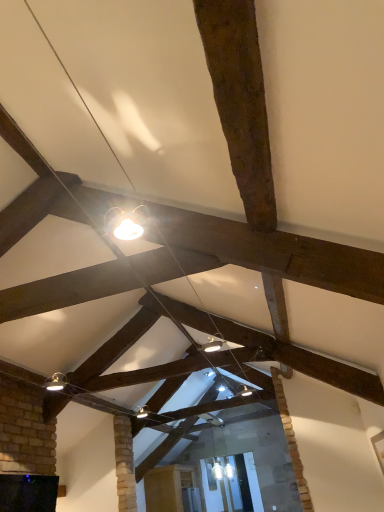
Question: Considering the positions of point (61, 378) and point (147, 484), is point (61, 378) closer or farther from the camera than point (147, 484)?

Choices:
 (A) farther
 (B) closer

Answer: (B)

Question: Is matte silver lamp at lower left in front of or behind wooden cabinet at center in the image?

Choices:
 (A) behind
 (B) front

Answer: (B)

Question: Would you say matte silver lamp at lower left is to the left or to the right of wooden cabinet at center in the picture?

Choices:
 (A) right
 (B) left

Answer: (B)

Question: Considering the positions of wooden cabinet at center and matte silver lamp at lower left in the image, is wooden cabinet at center taller or shorter than matte silver lamp at lower left?

Choices:
 (A) tall
 (B) short

Answer: (A)

Question: Does point (173, 485) appear closer or farther from the camera than point (54, 391)?

Choices:
 (A) closer
 (B) farther

Answer: (B)

Question: From a real-world perspective, is wooden cabinet at center positioned above or below matte silver lamp at lower left?

Choices:
 (A) below
 (B) above

Answer: (A)

Question: In terms of size, does wooden cabinet at center appear bigger or smaller than matte silver lamp at lower left?

Choices:
 (A) small
 (B) big

Answer: (B)